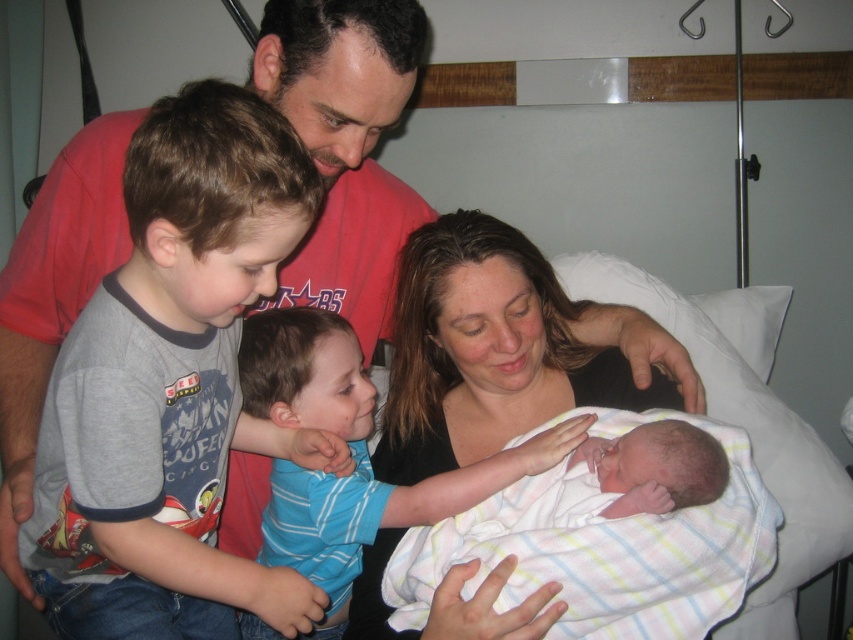
You are a nurse in the hospital room and need to check the baby wrapped in the soft white swaddling blanket at center. Where should you look relative to the blue striped shirt at center?

The soft white swaddling blanket at center is above the blue striped shirt at center, so you should look upward from the blue striped shirt at center to find the baby.

You are a photographer setting up a photo shoot in this hospital room scene. You need to position a small stool so that it is between the gray cotton shirt at left and the blue striped shirt at center. Given their heights, where should you place the stool to ensure it is visible to both subjects without blocking their view?

Since the gray cotton shirt at left is much taller than the blue striped shirt at center, the stool should be placed closer to the shorter blue striped shirt at center. This way, the stool will be at a lower height relative to the taller gray cotton shirt at left and still be visible to both subjects without obstruction.